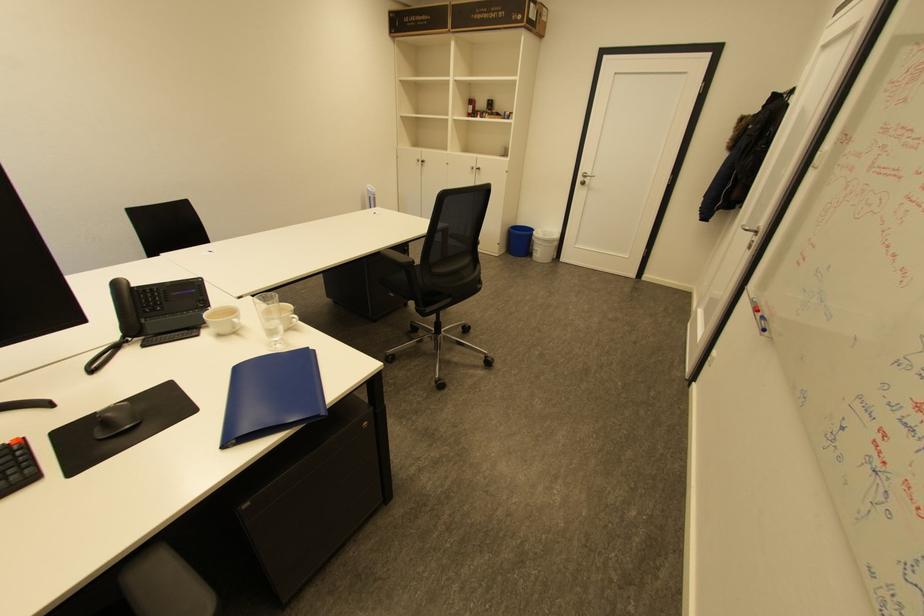
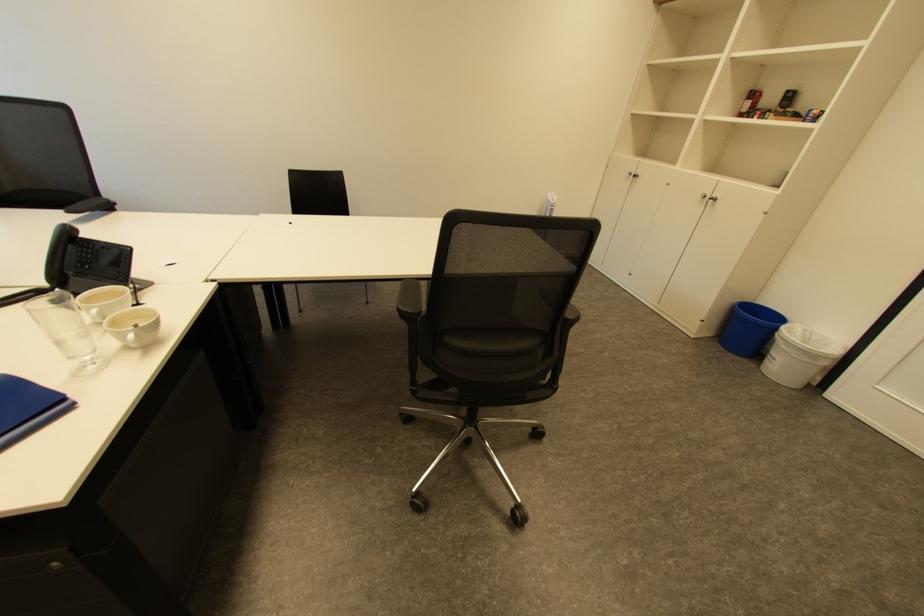
In the second image, find the point that corresponds to (479,168) in the first image.

(711, 196)